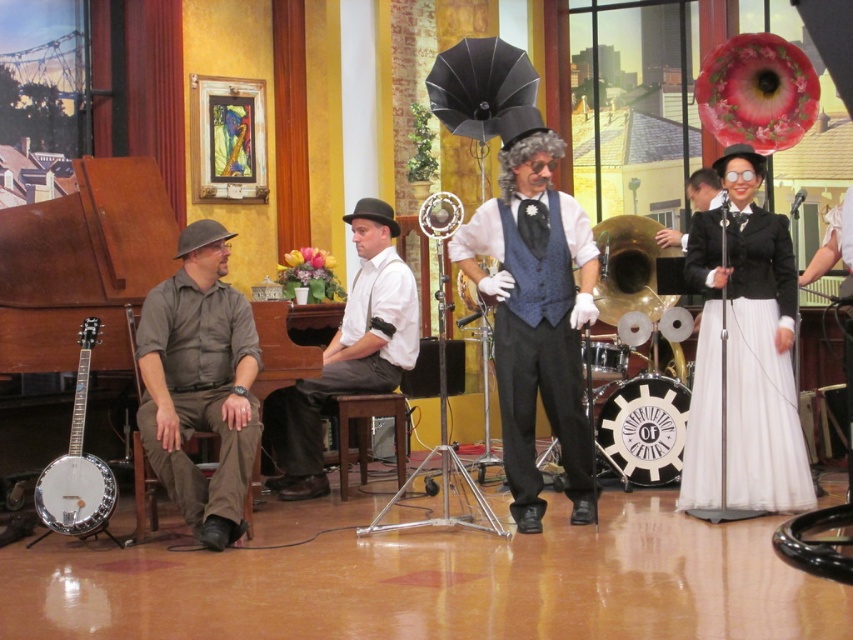
Question: Which point is closer to the camera?

Choices:
 (A) wooden stool at center
 (B) silver metallic banjo at left
 (C) gold brass tuba at center

Answer: (B)

Question: Which object is farther from the camera taking this photo?

Choices:
 (A) wooden stool at center
 (B) white cotton shirt at center
 (C) blue textured vest at center
 (D) gold brass tuba at center

Answer: (D)

Question: Which object is the farthest from the white cotton shirt at center?

Choices:
 (A) white sheer dress at right
 (B) gold brass tuba at center
 (C) blue textured vest at center
 (D) khaki cotton shirt at left

Answer: (A)

Question: Can you confirm if khaki cotton shirt at left is positioned to the left of white sheer dress at right?

Choices:
 (A) yes
 (B) no

Answer: (A)

Question: Can you confirm if khaki cotton shirt at left is thinner than white cotton shirt at center?

Choices:
 (A) yes
 (B) no

Answer: (A)

Question: Can you confirm if khaki cotton shirt at left is bigger than silver metallic banjo at left?

Choices:
 (A) no
 (B) yes

Answer: (B)